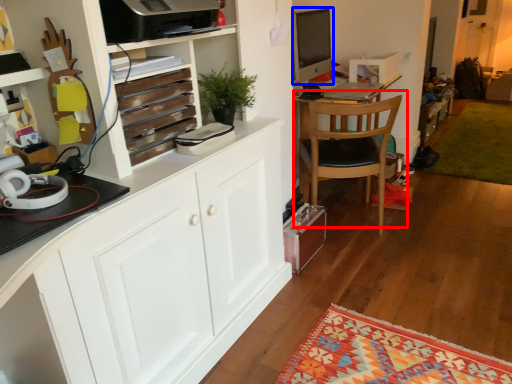
Question: Which of the following is the closest to the observer, chair (highlighted by a red box) or desktop computer (highlighted by a blue box)?

Choices:
 (A) chair
 (B) desktop computer

Answer: (A)